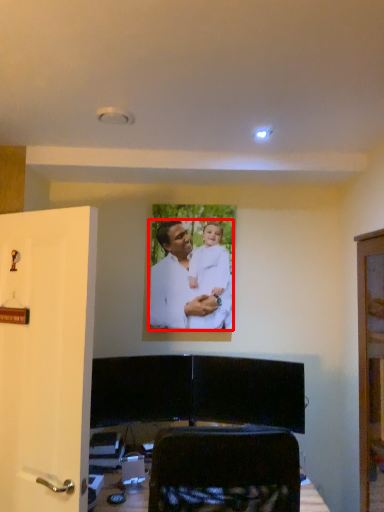
Question: From the image, what is the correct spatial relationship of man (annotated by the red box) in relation to door?

Choices:
 (A) left
 (B) right

Answer: (B)